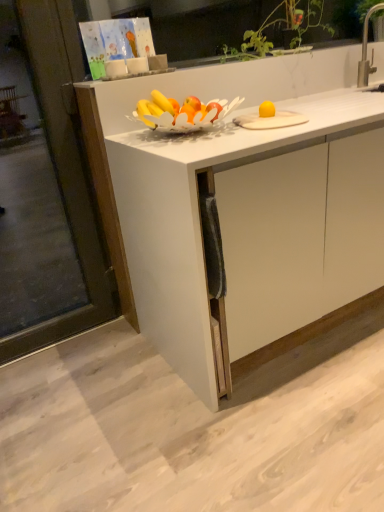
In order to click on free spot below transparent glass screen door at left (from a real-world perspective) in this screenshot , I will do `click(66, 343)`.